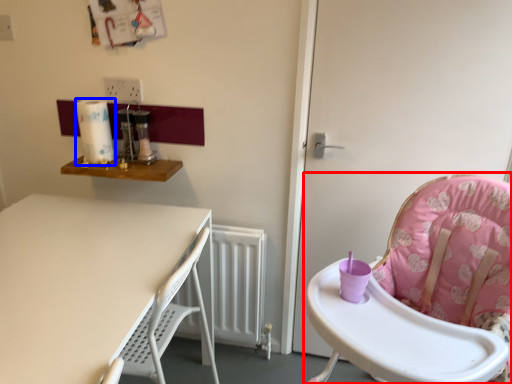
Question: Among these objects, which one is farthest to the camera, chair (highlighted by a red box) or paper towel (highlighted by a blue box)?

Choices:
 (A) chair
 (B) paper towel

Answer: (B)